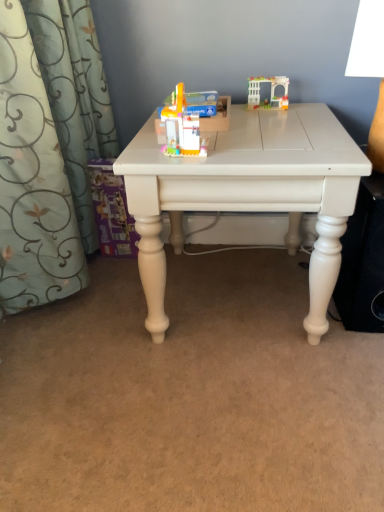
Image resolution: width=384 pixels, height=512 pixels. Find the location of `vacant region to the left of white matte speaker at lower right`. vacant region to the left of white matte speaker at lower right is located at coordinates (273, 301).